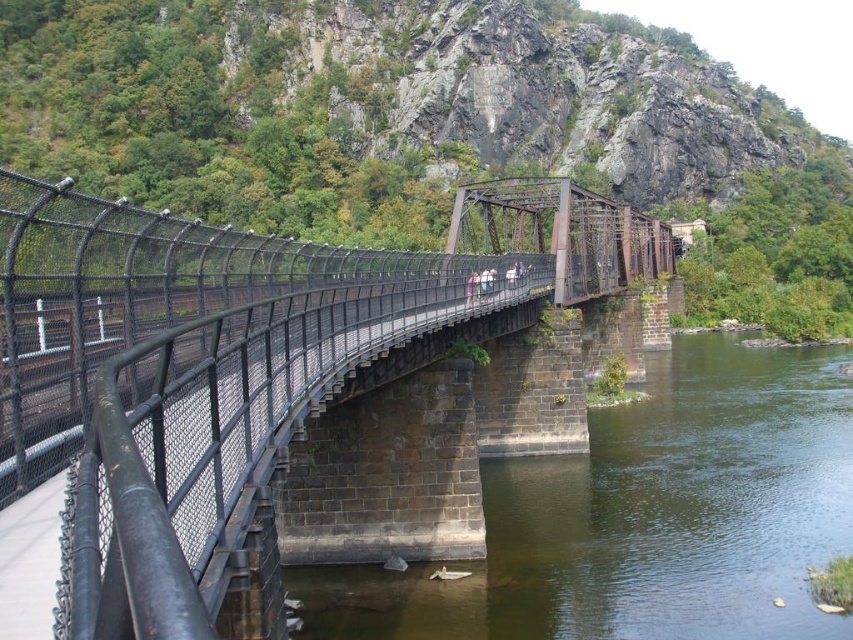
You are standing on the pedestrian bridge and want to locate the black metal fence at center. According to the coordinates provided, where should you look?

The black metal fence at center is located at point (241, 364) on the bridge.

You are standing on the pedestrian bridge and want to take a photo of both the point at coordinates (149,385) and the point at coordinates (610,584). Which point should you focus on first to ensure both are in focus?

You should focus on the point at coordinates (149,385) first because it is closer to the camera than the point at coordinates (610,584). This ensures that both points will be in focus as the closer point sets the focal plane.